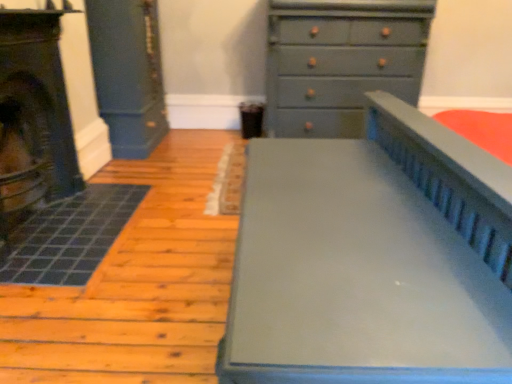
Measure the distance between point (12, 24) and camera.

Point (12, 24) and camera are 6.15 feet apart.

The height and width of the screenshot is (384, 512). I want to click on matte black fireplace at left, so click(x=33, y=116).

What do you see at coordinates (340, 61) in the screenshot? I see `matte gray chest of drawers at upper right` at bounding box center [340, 61].

Measure the distance between point (360, 26) and camera.

The depth of point (360, 26) is 10.61 feet.

You are a GUI agent. You are given a task and a screenshot of the screen. Output one action in this format:
    pyautogui.click(x=<x>, y=<y>)
    Task: Click on the matte gray bed at center
    The width and height of the screenshot is (512, 384).
    Given the screenshot: What is the action you would take?
    pyautogui.click(x=372, y=258)

The width and height of the screenshot is (512, 384). What are the coordinates of `matte black fireplace at left` in the screenshot? It's located at (33, 116).

In terms of height, does matte gray chest of drawers at upper right look taller or shorter compared to matte gray bed at center?

matte gray chest of drawers at upper right is taller than matte gray bed at center.

Find the location of `furniture that appears in front of the matte gray chest of drawers at upper right`. furniture that appears in front of the matte gray chest of drawers at upper right is located at coordinates (372, 258).

Is matte gray chest of drawers at upper right far away from matte gray bed at center?

Absolutely, matte gray chest of drawers at upper right is distant from matte gray bed at center.

From the picture: From a real-world perspective, which is physically below, matte gray chest of drawers at upper right or matte gray bed at center?

matte gray bed at center, from a real-world perspective.

Is matte gray bed at center in front of matte gray chest of drawers at upper right?

Yes, the depth of matte gray bed at center is less than that of matte gray chest of drawers at upper right.

Between point (443, 128) and point (336, 22), which one is positioned in front?

Point (443, 128)

From a real-world perspective, is matte gray bed at center physically above matte gray chest of drawers at upper right?

No, from a real-world perspective, matte gray bed at center is not over matte gray chest of drawers at upper right

Is matte gray bed at center facing towards matte gray chest of drawers at upper right?

No, matte gray bed at center is not facing towards matte gray chest of drawers at upper right.

Considering the sizes of objects matte gray chest of drawers at upper right and matte black fireplace at left in the image provided, who is shorter, matte gray chest of drawers at upper right or matte black fireplace at left?

Standing shorter between the two is matte black fireplace at left.

From the image's perspective, is matte gray chest of drawers at upper right positioned above or below matte black fireplace at left?

Clearly, from the image's perspective, matte gray chest of drawers at upper right is above matte black fireplace at left.

Which object is positioned more to the left, matte gray chest of drawers at upper right or matte black fireplace at left?

From the viewer's perspective, matte black fireplace at left appears more on the left side.

Between matte gray chest of drawers at upper right and matte black fireplace at left, which one has larger width?

matte gray chest of drawers at upper right.

Considering the positions of objects matte gray bed at center and matte black fireplace at left in the image provided, who is behind, matte gray bed at center or matte black fireplace at left?

matte black fireplace at left is further from the camera.

Considering the sizes of objects matte gray bed at center and matte black fireplace at left in the image provided, who is bigger, matte gray bed at center or matte black fireplace at left?

matte gray bed at center.

Identify the location of fireplace on the left of matte gray bed at center. The height and width of the screenshot is (384, 512). tap(33, 116).

Which is in front, point (69, 162) or point (276, 5)?

The point (69, 162) is closer.

Based on their positions, is matte black fireplace at left located to the left or right of matte gray chest of drawers at upper right?

Based on their positions, matte black fireplace at left is located to the left of matte gray chest of drawers at upper right.

Is matte black fireplace at left in front of or behind matte gray chest of drawers at upper right in the image?

matte black fireplace at left is positioned closer to the viewer than matte gray chest of drawers at upper right.

Considering the sizes of matte black fireplace at left and matte gray bed at center in the image, is matte black fireplace at left wider or thinner than matte gray bed at center?

Considering their sizes, matte black fireplace at left looks slimmer than matte gray bed at center.

From a real-world perspective, is matte black fireplace at left below matte gray bed at center?

No, from a real-world perspective, matte black fireplace at left is not under matte gray bed at center.

Considering the sizes of objects matte black fireplace at left and matte gray bed at center in the image provided, who is smaller, matte black fireplace at left or matte gray bed at center?

matte black fireplace at left is smaller.

Considering the relative sizes of matte black fireplace at left and matte gray bed at center in the image provided, is matte black fireplace at left taller than matte gray bed at center?

Yes.

At what (x,y) coordinates should I click in order to perform the action: click on furniture located in front of the matte gray chest of drawers at upper right. Please return your answer as a coordinate pair (x, y). Looking at the image, I should click on (372, 258).

Where is `furniture on the left side of matte gray chest of drawers at upper right`? The width and height of the screenshot is (512, 384). furniture on the left side of matte gray chest of drawers at upper right is located at coordinates (372, 258).

Which object lies nearer to the anchor point matte black fireplace at left, matte gray chest of drawers at upper right or matte gray bed at center?

matte gray bed at center is positioned closer to the anchor matte black fireplace at left.

Based on their spatial positions, is matte gray bed at center or matte gray chest of drawers at upper right closer to matte black fireplace at left?

The object closer to matte black fireplace at left is matte gray bed at center.

Which object lies further to the anchor point matte gray bed at center, matte gray chest of drawers at upper right or matte black fireplace at left?

matte gray chest of drawers at upper right is further to matte gray bed at center.

In the scene shown: Estimate the real-world distances between objects in this image. Which object is further from matte gray bed at center, matte black fireplace at left or matte gray chest of drawers at upper right?

matte gray chest of drawers at upper right.

When comparing their distances from matte gray chest of drawers at upper right, does matte gray bed at center or matte black fireplace at left seem further?

matte black fireplace at left is positioned further to the anchor matte gray chest of drawers at upper right.

From the picture: Considering their positions, is matte black fireplace at left positioned further to matte gray chest of drawers at upper right than matte gray bed at center?

The object further to matte gray chest of drawers at upper right is matte black fireplace at left.

Locate an element on the screen. This screenshot has height=384, width=512. fireplace between matte gray bed at center and matte gray chest of drawers at upper right from front to back is located at coordinates (33, 116).